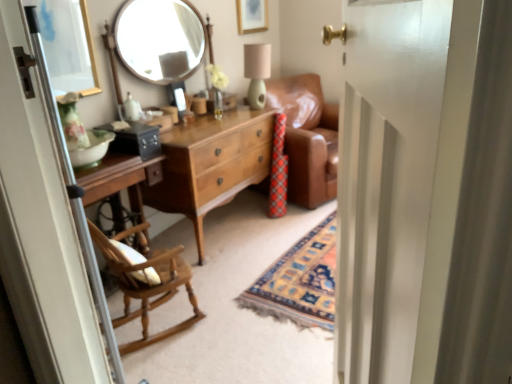
The image size is (512, 384). Find the location of `vacant area that lies to the right of wooden rocking chair at left`. vacant area that lies to the right of wooden rocking chair at left is located at coordinates (226, 322).